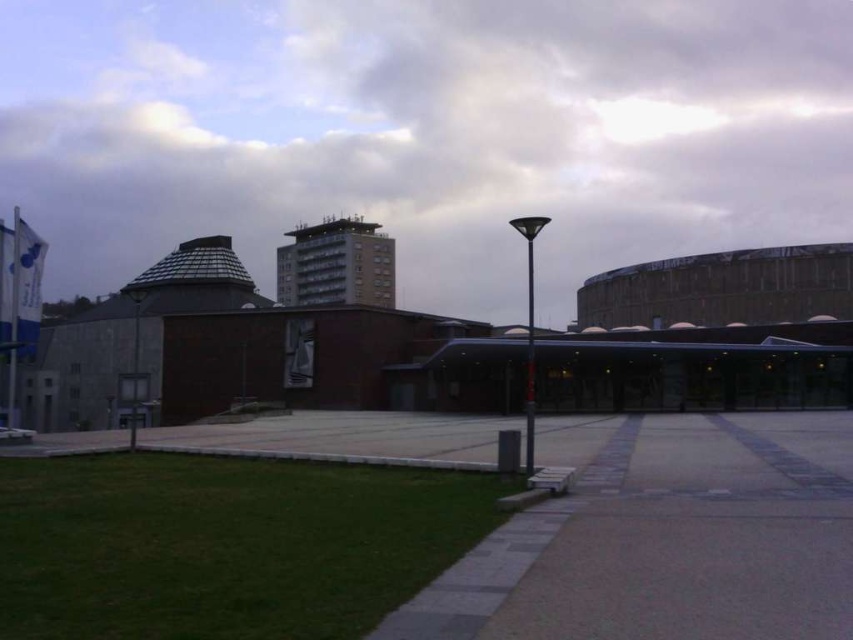
Question: Is white fluffy cloud at upper center positioned behind gray concrete pavement at center?

Choices:
 (A) yes
 (B) no

Answer: (A)

Question: Observing the image, what is the correct spatial positioning of white fluffy cloud at upper center in reference to gray concrete pavement at center?

Choices:
 (A) right
 (B) left

Answer: (B)

Question: Does white fluffy cloud at upper center appear over gray concrete pavement at center?

Choices:
 (A) no
 (B) yes

Answer: (B)

Question: Among these points, which one is farthest from the camera?

Choices:
 (A) (621, 464)
 (B) (236, 141)

Answer: (B)

Question: Which point appears farthest from the camera in this image?

Choices:
 (A) (338, 104)
 (B) (392, 612)

Answer: (A)